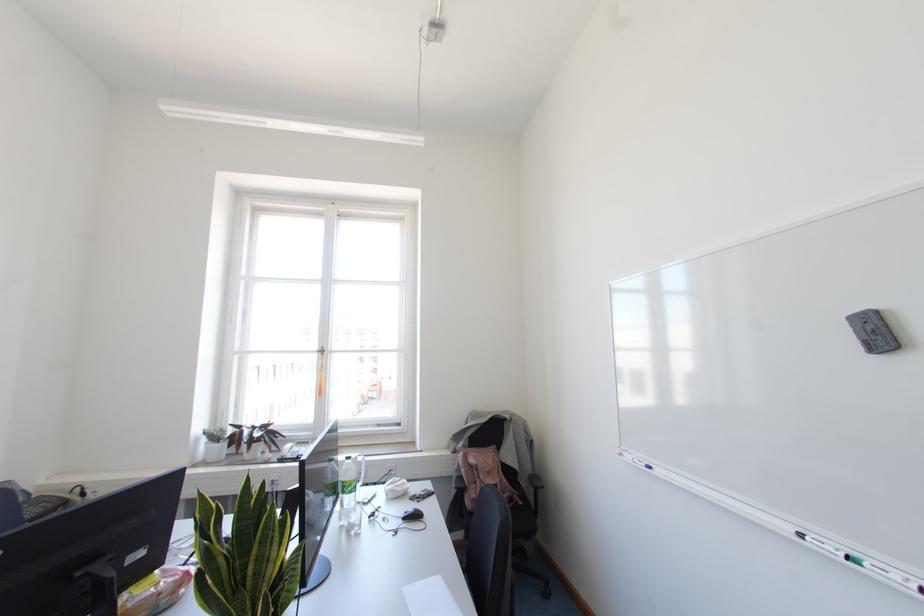
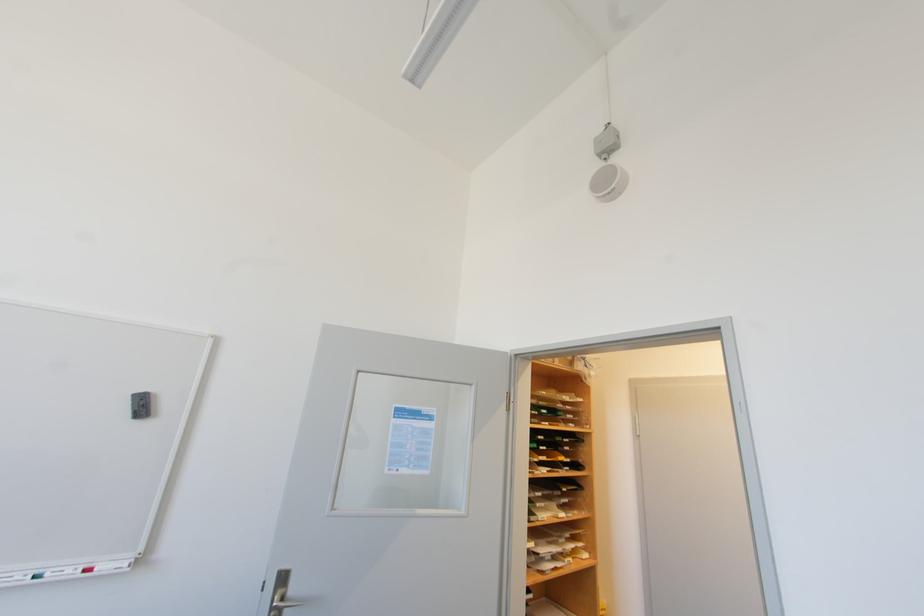
The first image is from the beginning of the video and the second image is from the end. How did the camera likely rotate when shooting the video?

The camera rotated toward right-up.